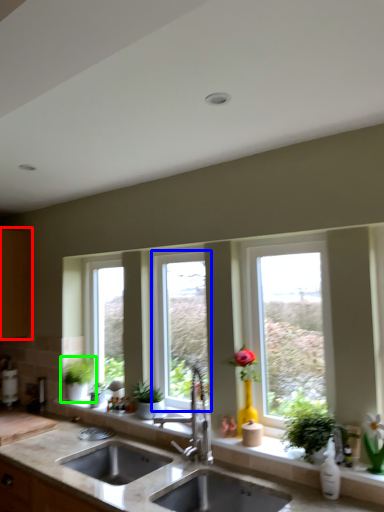
Question: Which object is the closest to the cabinetry (highlighted by a red box)? Choose among these: window (highlighted by a blue box) or houseplant (highlighted by a green box).

Choices:
 (A) window
 (B) houseplant

Answer: (B)